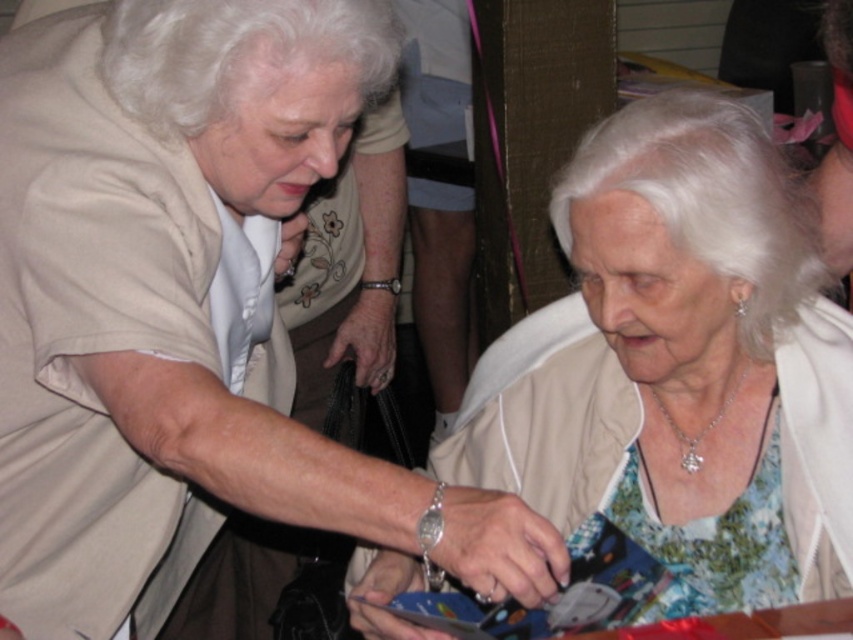
Can you confirm if matte beige blouse at center is positioned above matte beige jacket at center?

Yes.

Based on the photo, which of these two, matte beige blouse at center or matte beige jacket at center, stands taller?

matte beige blouse at center is taller.

This screenshot has width=853, height=640. In order to click on matte beige blouse at center in this screenshot , I will do `click(187, 307)`.